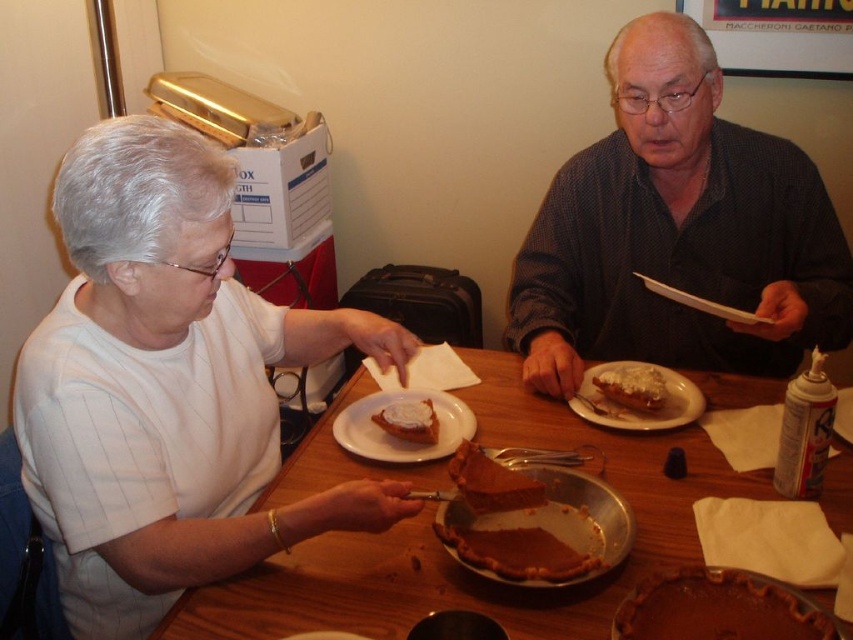
Does chocolate cake at center have a greater width compared to slightly browned crusty bread at upper right?

Yes, chocolate cake at center is wider than slightly browned crusty bread at upper right.

Is point (469, 467) farther from viewer compared to point (640, 378)?

No, (469, 467) is in front of (640, 378).

In order to click on chocolate cake at center in this screenshot , I will do `click(491, 483)`.

Does chocolate matte cake at center have a larger size compared to white glazed pastry at center?

No, chocolate matte cake at center is not bigger than white glazed pastry at center.

Does point (814, 609) come farther from viewer compared to point (677, 374)?

No, (814, 609) is closer to viewer.

Is point (641, 596) positioned behind point (616, 406)?

No, it is in front of (616, 406).

I want to click on chocolate matte cake at center, so click(x=718, y=609).

Where is `chocolate matte cake at center`? This screenshot has height=640, width=853. chocolate matte cake at center is located at coordinates (718, 609).

At what (x,y) coordinates should I click in order to perform the action: click on chocolate matte cake at center. Please return your answer as a coordinate pair (x, y). This screenshot has width=853, height=640. Looking at the image, I should click on (718, 609).